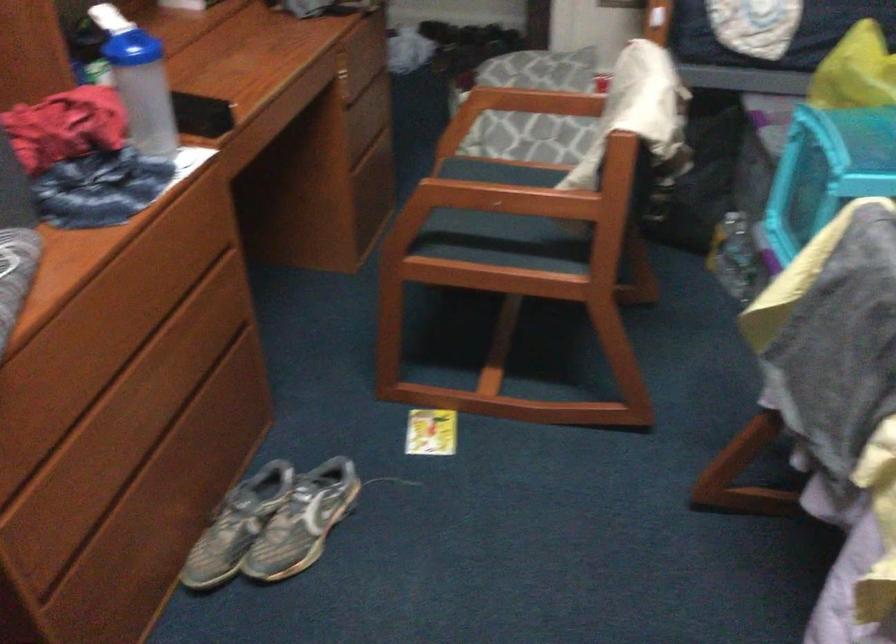
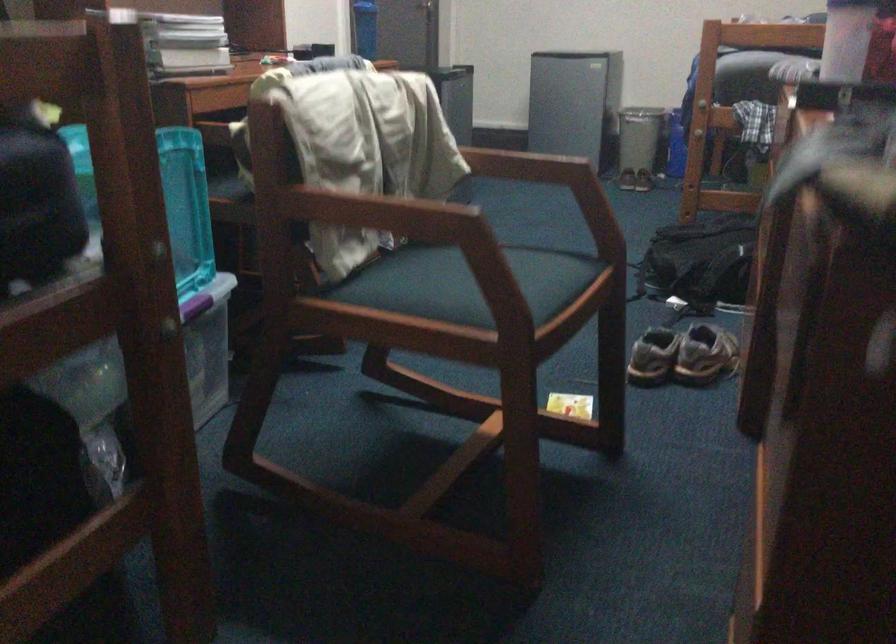
Locate, in the second image, the point that corresponds to the point at 300,462 in the first image.

(682, 355)